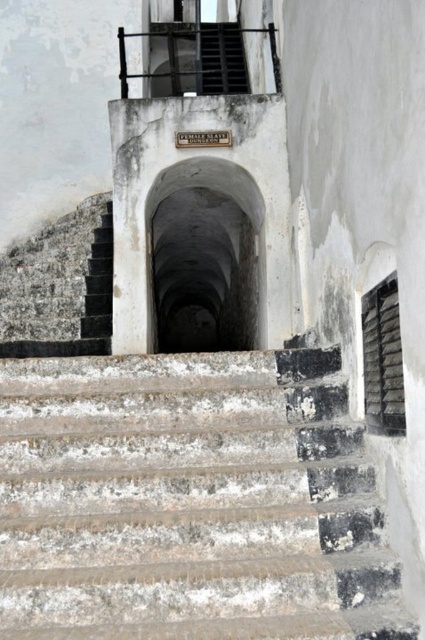
Can you confirm if worn concrete stairs at center is positioned to the right of black metal balustrade at upper center?

No, worn concrete stairs at center is not to the right of black metal balustrade at upper center.

Can you confirm if worn concrete stairs at center is positioned below black metal balustrade at upper center?

Correct, worn concrete stairs at center is located below black metal balustrade at upper center.

Between point (289, 520) and point (277, 83), which one is positioned behind?

The point (277, 83) is more distant.

At what (x,y) coordinates should I click in order to perform the action: click on worn concrete stairs at center. Please return your answer as a coordinate pair (x, y). The image size is (425, 640). Looking at the image, I should click on (155, 502).

Who is positioned more to the right, worn concrete stairs at center or rusty metal stairs at center?

rusty metal stairs at center

This screenshot has height=640, width=425. What do you see at coordinates (155, 502) in the screenshot? I see `worn concrete stairs at center` at bounding box center [155, 502].

This screenshot has width=425, height=640. Describe the element at coordinates (155, 502) in the screenshot. I see `worn concrete stairs at center` at that location.

Identify the location of worn concrete stairs at center. The image size is (425, 640). (155, 502).

Does rusty metal stairs at center come behind black metal balustrade at upper center?

No.

Who is more distant from viewer, (371, 502) or (209, 51)?

Positioned behind is point (209, 51).

Image resolution: width=425 pixels, height=640 pixels. What are the coordinates of `rusty metal stairs at center` in the screenshot? It's located at (342, 490).